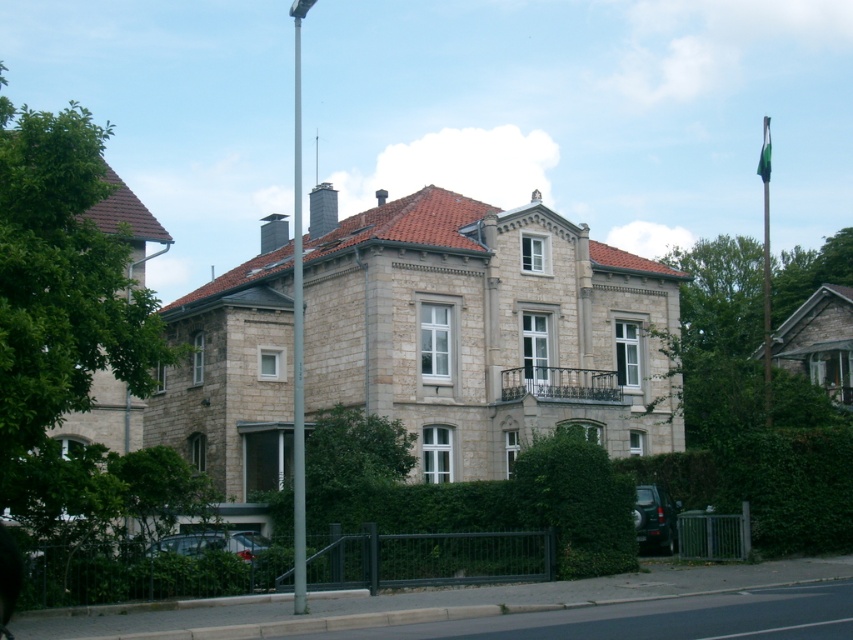
Image resolution: width=853 pixels, height=640 pixels. What do you see at coordinates (299, 337) in the screenshot? I see `metallic pole at center` at bounding box center [299, 337].

You are a GUI agent. You are given a task and a screenshot of the screen. Output one action in this format:
    pyautogui.click(x=<x>, y=<y>)
    Task: Click on the metallic pole at center
    The height and width of the screenshot is (640, 853).
    Given the screenshot: What is the action you would take?
    pyautogui.click(x=299, y=337)

Where is `metallic pole at center`? This screenshot has height=640, width=853. metallic pole at center is located at coordinates (299, 337).

Does shiny metallic car at lower center appear on the right side of green fabric flag pole at right?

No, shiny metallic car at lower center is not to the right of green fabric flag pole at right.

Between shiny metallic car at lower center and green fabric flag pole at right, which one appears on the right side from the viewer's perspective?

From the viewer's perspective, green fabric flag pole at right appears more on the right side.

Identify the location of shiny metallic car at lower center. (212, 544).

This screenshot has height=640, width=853. I want to click on shiny metallic car at lower center, so click(212, 544).

Measure the distance between point (654, 529) and camera.

Point (654, 529) and camera are 53.66 meters apart.

Does metallic silver suv at lower right have a smaller size compared to shiny metallic car at lower center?

Correct, metallic silver suv at lower right occupies less space than shiny metallic car at lower center.

Is point (660, 509) positioned in front of point (268, 544)?

That is False.

The width and height of the screenshot is (853, 640). In order to click on metallic silver suv at lower right in this screenshot , I will do `click(654, 518)`.